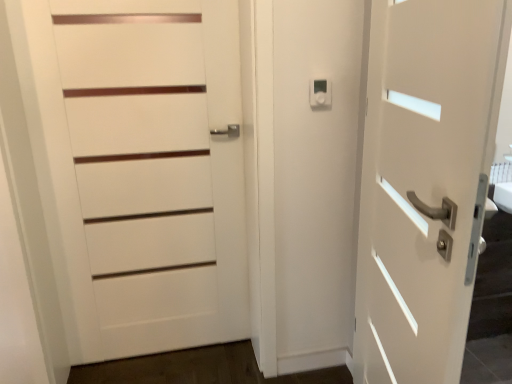
What do you see at coordinates (425, 182) in the screenshot?
I see `white matte door at right, positioned as the 2th door in left-to-right order` at bounding box center [425, 182].

Locate an element on the screen. white plastic thermostat at upper center is located at coordinates (320, 93).

Who is shorter, white matte door at right, which is counted as the first door, starting from the right, or white matte door at left, positioned as the second door in right-to-left order?

white matte door at right, which is counted as the first door, starting from the right, is shorter.

Can white matte door at left, positioned as the second door in right-to-left order, be found inside white matte door at right, which is counted as the first door, starting from the right?

No, white matte door at left, positioned as the second door in right-to-left order, is not inside white matte door at right, which is counted as the first door, starting from the right.

Which is behind, point (392, 237) or point (160, 138)?

The point (160, 138) is farther.

Are white matte door at right, positioned as the 2th door in left-to-right order, and white matte door at left, positioned as the second door in right-to-left order, beside each other?

No, white matte door at right, positioned as the 2th door in left-to-right order, is not next to white matte door at left, positioned as the second door in right-to-left order.

Is white plastic thermostat at upper center thinner than white matte door at left, the 1th door from the left?

Correct, the width of white plastic thermostat at upper center is less than that of white matte door at left, the 1th door from the left.

Is white plastic thermostat at upper center to the left of white matte door at left, positioned as the second door in right-to-left order, from the viewer's perspective?

In fact, white plastic thermostat at upper center is to the right of white matte door at left, positioned as the second door in right-to-left order.

Is white plastic thermostat at upper center placed right next to white matte door at left, the 1th door from the left?

No, white plastic thermostat at upper center is not with white matte door at left, the 1th door from the left.

How much distance is there between white plastic thermostat at upper center and white matte door at right, which is counted as the first door, starting from the right?

They are 26.53 inches apart.

From the image's perspective, is white plastic thermostat at upper center above white matte door at right, which is counted as the first door, starting from the right?

Indeed, from the image's perspective, white plastic thermostat at upper center is shown above white matte door at right, which is counted as the first door, starting from the right.

Which object is further away from the camera taking this photo, white plastic thermostat at upper center or white matte door at right, positioned as the 2th door in left-to-right order?

white plastic thermostat at upper center is behind.

At what (x,y) coordinates should I click in order to perform the action: click on knob on the left of the white matte door at right, which is counted as the first door, starting from the right. Please return your answer as a coordinate pair (x, y). This screenshot has width=512, height=384. Looking at the image, I should click on (320, 93).

Considering the relative positions of white matte door at right, positioned as the 2th door in left-to-right order, and white plastic thermostat at upper center in the image provided, is white matte door at right, positioned as the 2th door in left-to-right order, to the right of white plastic thermostat at upper center from the viewer's perspective?

Yes, white matte door at right, positioned as the 2th door in left-to-right order, is to the right of white plastic thermostat at upper center.

Considering the sizes of objects white matte door at right, which is counted as the first door, starting from the right, and white plastic thermostat at upper center in the image provided, who is wider, white matte door at right, which is counted as the first door, starting from the right, or white plastic thermostat at upper center?

white matte door at right, which is counted as the first door, starting from the right, is wider.

Is white matte door at right, positioned as the 2th door in left-to-right order, positioned far away from white plastic thermostat at upper center?

No, white matte door at right, positioned as the 2th door in left-to-right order, is not far from white plastic thermostat at upper center.

Is white matte door at right, which is counted as the first door, starting from the right, not within white plastic thermostat at upper center?

white matte door at right, which is counted as the first door, starting from the right, is positioned outside white plastic thermostat at upper center.

Is white matte door at right, which is counted as the first door, starting from the right, inside white matte door at left, positioned as the second door in right-to-left order?

No, white matte door at right, which is counted as the first door, starting from the right, is located outside of white matte door at left, positioned as the second door in right-to-left order.

From the image's perspective, which is below, white matte door at left, the 1th door from the left, or white matte door at right, which is counted as the first door, starting from the right?

white matte door at right, which is counted as the first door, starting from the right, appears lower in the image.

Can you tell me how much white matte door at left, the 1th door from the left, and white matte door at right, positioned as the 2th door in left-to-right order, differ in facing direction?

The facing directions of white matte door at left, the 1th door from the left, and white matte door at right, positioned as the 2th door in left-to-right order, are 89.8 degrees apart.

Would you say white matte door at left, positioned as the second door in right-to-left order, is to the left or to the right of white matte door at right, positioned as the 2th door in left-to-right order, in the picture?

In the image, white matte door at left, positioned as the second door in right-to-left order, appears on the left side of white matte door at right, positioned as the 2th door in left-to-right order.

Looking at this image, from a real-world perspective, is white matte door at left, the 1th door from the left, under white plastic thermostat at upper center?

Correct, in the physical world, white matte door at left, the 1th door from the left, is lower than white plastic thermostat at upper center.

Is white matte door at left, positioned as the second door in right-to-left order, looking in the opposite direction of white plastic thermostat at upper center?

No.

What's the angular difference between white matte door at left, the 1th door from the left, and white plastic thermostat at upper center's facing directions?

0.249 degrees.

This screenshot has height=384, width=512. In order to click on door that is in front of the white matte door at left, the 1th door from the left in this screenshot , I will do `click(425, 182)`.

The height and width of the screenshot is (384, 512). Find the location of `knob above the white matte door at left, positioned as the second door in right-to-left order (from the image's perspective)`. knob above the white matte door at left, positioned as the second door in right-to-left order (from the image's perspective) is located at coordinates (320, 93).

From the image, which object appears to be farther from white plastic thermostat at upper center, white matte door at left, the 1th door from the left, or white matte door at right, positioned as the 2th door in left-to-right order?

Based on the image, white matte door at left, the 1th door from the left, appears to be further to white plastic thermostat at upper center.

When comparing their distances from white matte door at right, which is counted as the first door, starting from the right, does white plastic thermostat at upper center or white matte door at left, positioned as the second door in right-to-left order, seem further?

white matte door at left, positioned as the second door in right-to-left order, is further to white matte door at right, which is counted as the first door, starting from the right.

Looking at the image, which one is located further to white matte door at left, positioned as the second door in right-to-left order, white plastic thermostat at upper center or white matte door at right, which is counted as the first door, starting from the right?

Based on the image, white matte door at right, which is counted as the first door, starting from the right, appears to be further to white matte door at left, positioned as the second door in right-to-left order.

Which object lies nearer to the anchor point white matte door at left, positioned as the second door in right-to-left order, white matte door at right, which is counted as the first door, starting from the right, or white plastic thermostat at upper center?

white plastic thermostat at upper center is closer to white matte door at left, positioned as the second door in right-to-left order.

Looking at the image, which one is located closer to white plastic thermostat at upper center, white matte door at right, positioned as the 2th door in left-to-right order, or white matte door at left, positioned as the second door in right-to-left order?

white matte door at right, positioned as the 2th door in left-to-right order, is closer to white plastic thermostat at upper center.

Considering their positions, is white matte door at left, the 1th door from the left, positioned further to white matte door at right, which is counted as the first door, starting from the right, than white plastic thermostat at upper center?

white matte door at left, the 1th door from the left.

This screenshot has width=512, height=384. What are the coordinates of `knob between white matte door at left, the 1th door from the left, and white matte door at right, which is counted as the first door, starting from the right` in the screenshot? It's located at (320, 93).